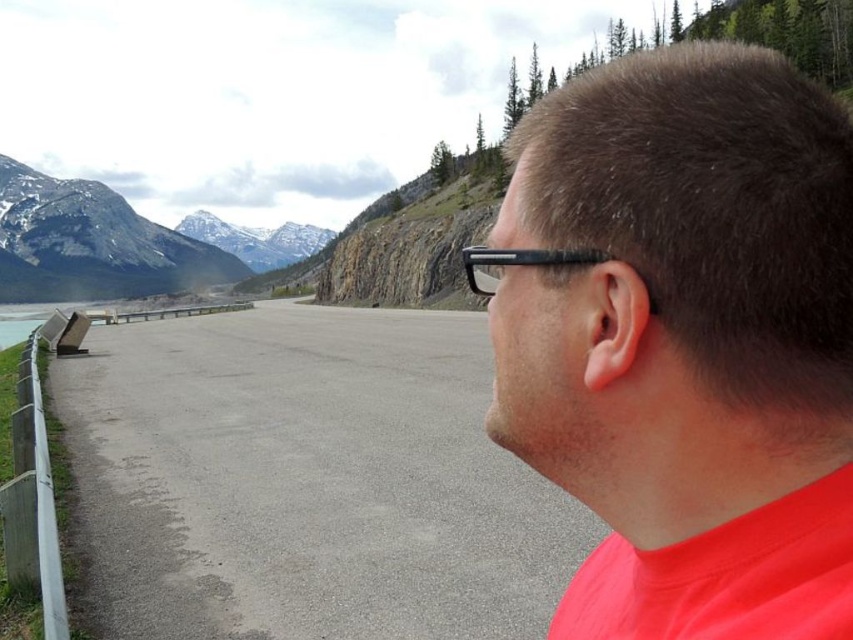
Question: Does gray asphalt road at center appear over rocky gray mountain at left?

Choices:
 (A) yes
 (B) no

Answer: (B)

Question: Which object is farther from the camera taking this photo?

Choices:
 (A) matte black glasses at upper right
 (B) brushed metal bench at left
 (C) rocky gray mountain at left

Answer: (C)

Question: Which is nearer to the matte black glasses at upper right?

Choices:
 (A) gray asphalt road at center
 (B) rocky gray mountain at left
 (C) brushed metal bench at left

Answer: (A)

Question: Estimate the real-world distances between objects in this image. Which object is closer to the gray asphalt road at center?

Choices:
 (A) brushed metal bench at left
 (B) matte black glasses at upper right

Answer: (B)

Question: Considering the relative positions of matte black glasses at upper right and rocky gray mountain at left in the image provided, where is matte black glasses at upper right located with respect to rocky gray mountain at left?

Choices:
 (A) right
 (B) left

Answer: (A)

Question: Does gray asphalt road at center appear on the right side of brushed metal bench at left?

Choices:
 (A) no
 (B) yes

Answer: (B)